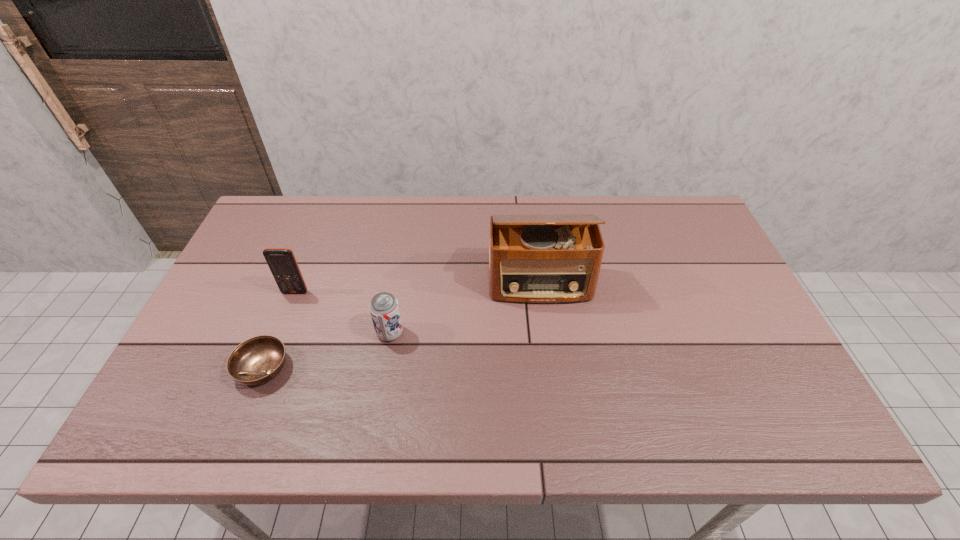
The height and width of the screenshot is (540, 960). What are the coordinates of `vacant region between the third shortest object and the soup bowl` in the screenshot? It's located at (279, 330).

The image size is (960, 540). I want to click on unoccupied position between the radio receiver and the second shortest object, so click(x=465, y=308).

Locate an element on the screen. free point between the cellular telephone and the second nearest object is located at coordinates (343, 313).

Where is `free space between the soup bowl and the third tallest object`? The image size is (960, 540). free space between the soup bowl and the third tallest object is located at coordinates (326, 350).

Image resolution: width=960 pixels, height=540 pixels. What are the coordinates of `free space between the second nearest object and the nearest object` in the screenshot? It's located at (326, 350).

You are a GUI agent. You are given a task and a screenshot of the screen. Output one action in this format:
    pyautogui.click(x=<x>, y=<y>)
    Task: Click on the free area in between the radio receiver and the beer can
    This screenshot has height=540, width=960.
    Given the screenshot: What is the action you would take?
    pyautogui.click(x=465, y=308)

Where is `the closest object to the soup bowl`? This screenshot has height=540, width=960. the closest object to the soup bowl is located at coordinates (282, 263).

Choose which object is the second nearest neighbor to the beer can. Please provide its 2D coordinates. Your answer should be formatted as a tuple, i.e. [(x, y)], where the tuple contains the x and y coordinates of a point satisfying the conditions above.

[(543, 259)]

You are a GUI agent. You are given a task and a screenshot of the screen. Output one action in this format:
    pyautogui.click(x=<x>, y=<y>)
    Task: Click on the vacant space that satisfies the following two spatial constraints: 1. on the screen of the second nearest object; 2. on the right side of the third shortest object
    The height and width of the screenshot is (540, 960).
    Given the screenshot: What is the action you would take?
    pyautogui.click(x=279, y=333)

The width and height of the screenshot is (960, 540). Find the location of `vacant region that satisfies the following two spatial constraints: 1. on the back side of the soup bowl; 2. on the right side of the beer can`. vacant region that satisfies the following two spatial constraints: 1. on the back side of the soup bowl; 2. on the right side of the beer can is located at coordinates (276, 333).